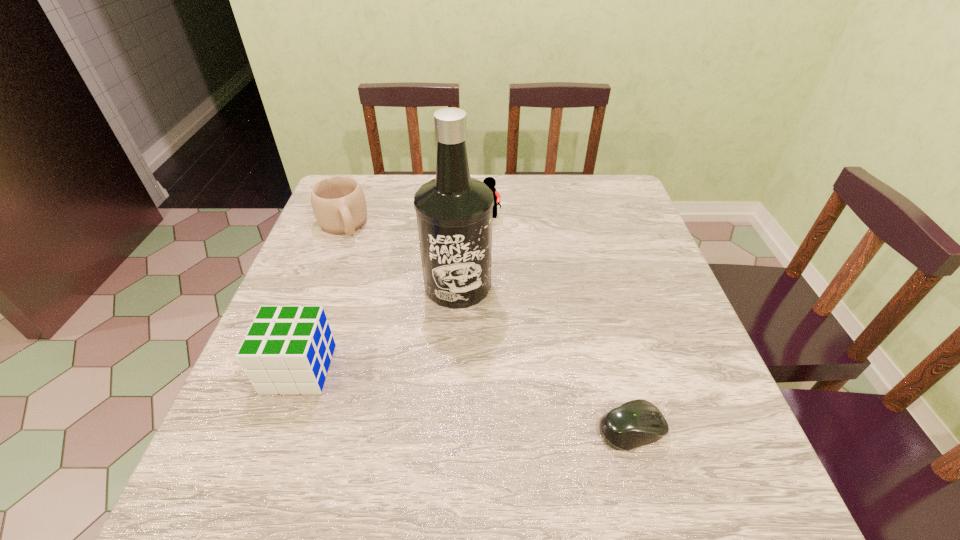
Identify the location of cube that is at the left edge. This screenshot has width=960, height=540. (287, 350).

I want to click on mug positioned at the left edge, so click(338, 202).

Identify the location of object at the right edge. (635, 423).

Locate an element on the screen. This screenshot has width=960, height=540. object present at the far left corner is located at coordinates (338, 202).

At what (x,y) coordinates should I click in order to perform the action: click on object that is at the near right corner. Please return your answer as a coordinate pair (x, y). Looking at the image, I should click on coord(635,423).

The width and height of the screenshot is (960, 540). Identify the location of free space at the far edge of the desktop. (558, 185).

In the image, there is a desktop. Where is `vacant space at the near edge`? vacant space at the near edge is located at coordinates (563, 435).

Image resolution: width=960 pixels, height=540 pixels. What are the coordinates of `vacant region at the left edge of the desktop` in the screenshot? It's located at (311, 283).

I want to click on vacant region at the right edge, so click(x=607, y=225).

This screenshot has width=960, height=540. I want to click on vacant space at the far right corner, so click(x=631, y=210).